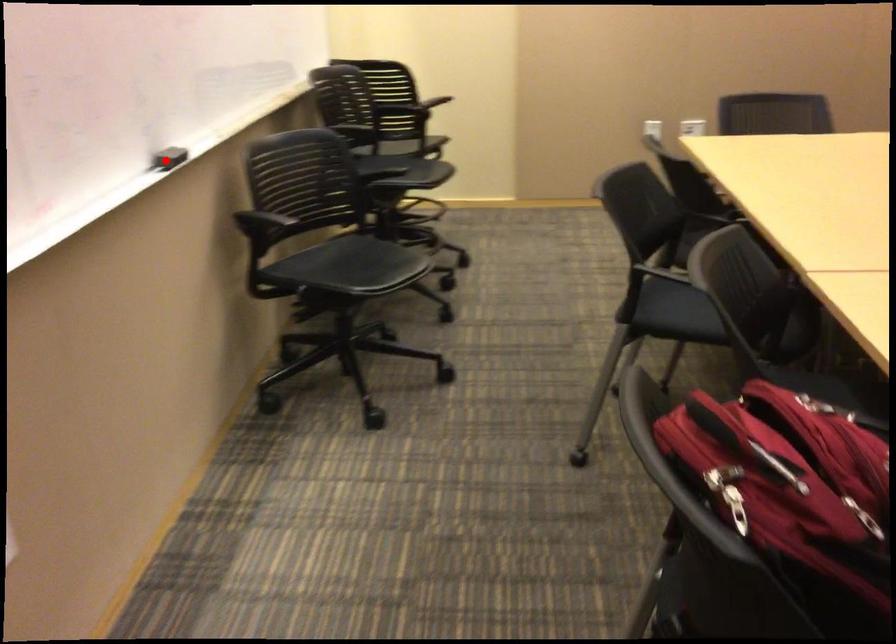
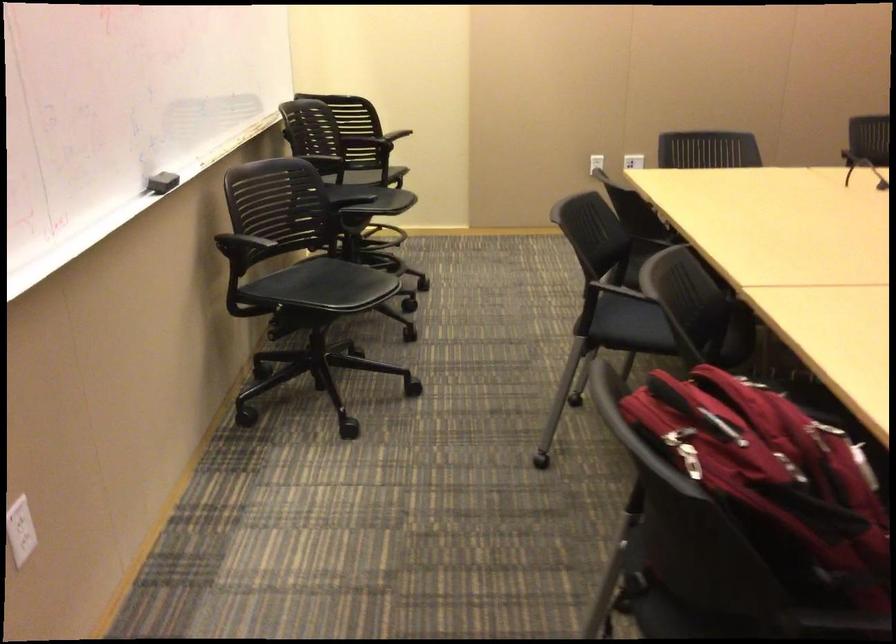
Where in the second image is the point corresponding to the highlighted location from the first image?

(161, 182)